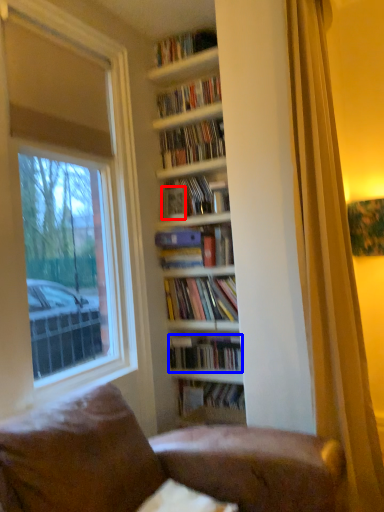
Question: Which object appears farthest to the camera in this image, paperback book (highlighted by a red box) or book (highlighted by a blue box)?

Choices:
 (A) paperback book
 (B) book

Answer: (A)